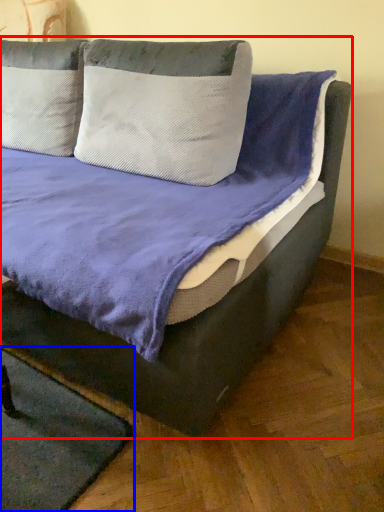
Question: Among these objects, which one is nearest to the camera, bed (highlighted by a red box) or mat (highlighted by a blue box)?

Choices:
 (A) bed
 (B) mat

Answer: (A)